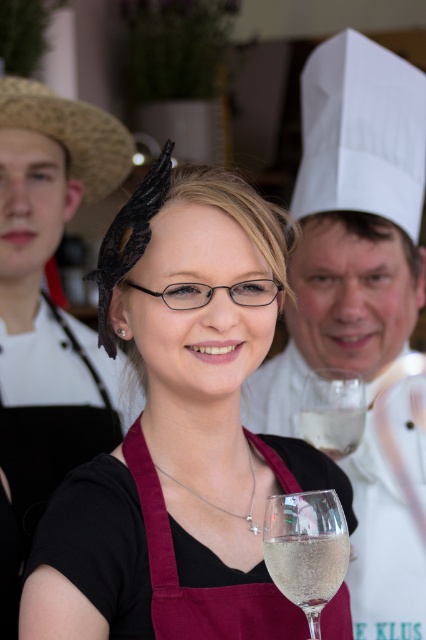
Question: From the image, what is the correct spatial relationship of maroon fabric apron at center in relation to clear glass wine glass at center?

Choices:
 (A) right
 (B) left

Answer: (B)

Question: Considering the relative positions of maroon fabric apron at center and clear glass wine glass at center in the image provided, where is maroon fabric apron at center located with respect to clear glass wine glass at center?

Choices:
 (A) right
 (B) left

Answer: (B)

Question: Is matte black hair clip at center bigger than clear glass at center?

Choices:
 (A) yes
 (B) no

Answer: (A)

Question: Which object is the closest to the matte black hair clip at center?

Choices:
 (A) strawmaterial/texturehat at left
 (B) white chef hat at upper center
 (C) maroon fabric apron at center
 (D) clear glass wine glass at center

Answer: (C)

Question: Estimate the real-world distances between objects in this image. Which object is closer to the maroon fabric apron at center?

Choices:
 (A) white chef hat at upper center
 (B) clear glass at center
 (C) strawmaterial/texturehat at left
 (D) matte black hair clip at center

Answer: (D)

Question: Which object is farther from the camera taking this photo?

Choices:
 (A) white chef hat at upper center
 (B) maroon fabric apron at center

Answer: (A)